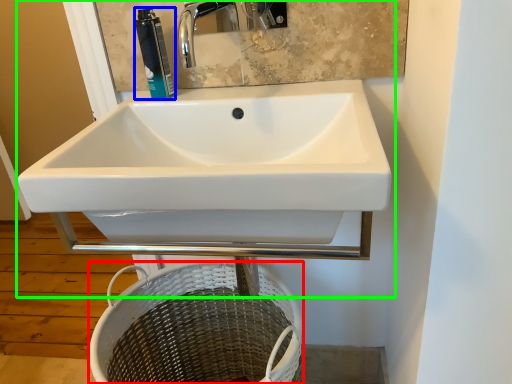
Question: Which is nearer to the basket (highlighted by a red box)? toiletry (highlighted by a blue box) or sink (highlighted by a green box).

Choices:
 (A) toiletry
 (B) sink

Answer: (B)